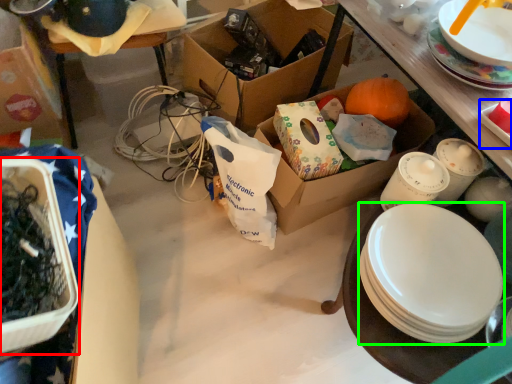
Question: Considering the real-world distances, which object is farthest from box (highlighted by a red box)? platter (highlighted by a blue box) or plate (highlighted by a green box)?

Choices:
 (A) platter
 (B) plate

Answer: (A)